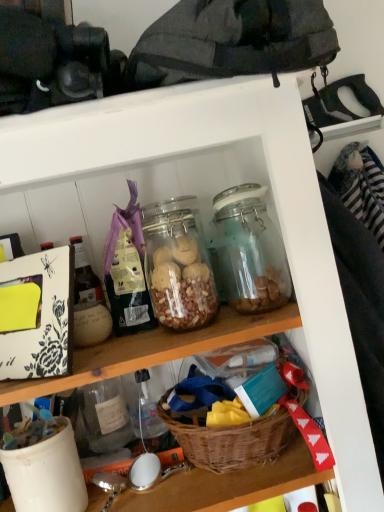
Question: From a real-world perspective, is translucent glass jar at center under woven brown basket at lower center?

Choices:
 (A) no
 (B) yes

Answer: (A)

Question: From the image's perspective, is translucent glass jar at center above woven brown basket at lower center?

Choices:
 (A) no
 (B) yes

Answer: (B)

Question: Is translucent glass jar at center located outside woven brown basket at lower center?

Choices:
 (A) no
 (B) yes

Answer: (B)

Question: From a real-world perspective, is translucent glass jar at center on woven brown basket at lower center?

Choices:
 (A) no
 (B) yes

Answer: (B)

Question: Can you confirm if translucent glass jar at center is positioned to the left of woven brown basket at lower center?

Choices:
 (A) no
 (B) yes

Answer: (B)

Question: Does translucent glass jar at center appear on the right side of woven brown basket at lower center?

Choices:
 (A) no
 (B) yes

Answer: (A)

Question: Does woven brown basket at lower center turn towards translucent glass jar at center?

Choices:
 (A) no
 (B) yes

Answer: (A)

Question: Does woven brown basket at lower center have a greater width compared to translucent glass jar at center?

Choices:
 (A) yes
 (B) no

Answer: (A)

Question: Is translucent glass jar at center inside woven brown basket at lower center?

Choices:
 (A) yes
 (B) no

Answer: (B)

Question: Can you confirm if woven brown basket at lower center is bigger than translucent glass jar at center?

Choices:
 (A) yes
 (B) no

Answer: (A)

Question: Is woven brown basket at lower center placed right next to translucent glass jar at center?

Choices:
 (A) no
 (B) yes

Answer: (A)

Question: Considering the relative sizes of woven brown basket at lower center and translucent glass jar at center in the image provided, is woven brown basket at lower center taller than translucent glass jar at center?

Choices:
 (A) yes
 (B) no

Answer: (B)

Question: From the image's perspective, is woven brown basket at lower center above or below translucent glass jar at center?

Choices:
 (A) above
 (B) below

Answer: (B)